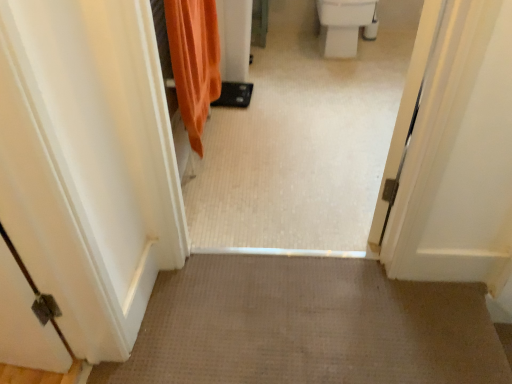
Locate an element on the screen. The image size is (512, 384). white glossy tile floor at center is located at coordinates (303, 144).

Is white glossy toilet bowl at upper right bigger or smaller than orange fabric shower curtain at upper left?

In the image, white glossy toilet bowl at upper right appears to be larger than orange fabric shower curtain at upper left.

Where is `toilet bowl lying above the orange fabric shower curtain at upper left (from the image's perspective)`? The height and width of the screenshot is (384, 512). toilet bowl lying above the orange fabric shower curtain at upper left (from the image's perspective) is located at coordinates (344, 25).

Is white glossy toilet bowl at upper right behind orange fabric shower curtain at upper left?

Yes, it is.

Is white glossy toilet bowl at upper right looking in the opposite direction of orange fabric shower curtain at upper left?

No, white glossy toilet bowl at upper right is not facing away from orange fabric shower curtain at upper left.

Is point (203, 38) positioned behind point (311, 213)?

Yes, point (203, 38) is farther from viewer.

Considering the relative positions of orange fabric shower curtain at upper left and white glossy tile floor at center in the image provided, is orange fabric shower curtain at upper left to the left or to the right of white glossy tile floor at center?

Based on their positions, orange fabric shower curtain at upper left is located to the left of white glossy tile floor at center.

Can you confirm if orange fabric shower curtain at upper left is bigger than white glossy tile floor at center?

No.

The width and height of the screenshot is (512, 384). I want to click on toilet bowl that appears below the white glossy tile floor at center (from a real-world perspective), so click(x=344, y=25).

Could you tell me if white glossy tile floor at center is turned towards white glossy toilet bowl at upper right?

Yes, white glossy tile floor at center is aimed at white glossy toilet bowl at upper right.

Is white glossy toilet bowl at upper right inside white glossy tile floor at center?

No, white glossy toilet bowl at upper right is located outside of white glossy tile floor at center.

Which object is closer to the camera, white glossy tile floor at center or white glossy toilet bowl at upper right?

white glossy tile floor at center is more forward.

Considering the positions of objects white glossy toilet bowl at upper right and white glossy tile floor at center in the image provided, who is more to the right, white glossy toilet bowl at upper right or white glossy tile floor at center?

From the viewer's perspective, white glossy toilet bowl at upper right appears more on the right side.

Where is `toilet bowl above the white glossy tile floor at center (from the image's perspective)`? toilet bowl above the white glossy tile floor at center (from the image's perspective) is located at coordinates (344, 25).

From the image's perspective, would you say white glossy toilet bowl at upper right is shown under white glossy tile floor at center?

No, from the image's perspective, white glossy toilet bowl at upper right is not beneath white glossy tile floor at center.

Considering the relative sizes of white glossy toilet bowl at upper right and white glossy tile floor at center in the image provided, is white glossy toilet bowl at upper right taller than white glossy tile floor at center?

No.

Does white glossy tile floor at center have a greater height compared to orange fabric shower curtain at upper left?

Correct, white glossy tile floor at center is much taller as orange fabric shower curtain at upper left.

Can you confirm if white glossy tile floor at center is wider than orange fabric shower curtain at upper left?

Yes, white glossy tile floor at center is wider than orange fabric shower curtain at upper left.

Is orange fabric shower curtain at upper left surrounded by white glossy tile floor at center?

No, white glossy tile floor at center does not contain orange fabric shower curtain at upper left.

Could you tell me if orange fabric shower curtain at upper left is turned towards white glossy toilet bowl at upper right?

No, orange fabric shower curtain at upper left is not facing towards white glossy toilet bowl at upper right.

Considering the positions of point (205, 66) and point (359, 13), is point (205, 66) closer or farther from the camera than point (359, 13)?

Point (205, 66) is positioned closer to the camera compared to point (359, 13).

Locate an element on the screen. The height and width of the screenshot is (384, 512). toilet bowl on the right of orange fabric shower curtain at upper left is located at coordinates (344, 25).

In the scene shown: Does orange fabric shower curtain at upper left appear on the right side of white glossy toilet bowl at upper right?

In fact, orange fabric shower curtain at upper left is to the left of white glossy toilet bowl at upper right.

Locate an element on the screen. The image size is (512, 384). toilet bowl lying behind the orange fabric shower curtain at upper left is located at coordinates (344, 25).

There is a orange fabric shower curtain at upper left. Identify the location of passage above it (from a real-world perspective). (303, 144).

When comparing their distances from white glossy toilet bowl at upper right, does white glossy tile floor at center or orange fabric shower curtain at upper left seem closer?

white glossy tile floor at center lies closer to white glossy toilet bowl at upper right than the other object.

Considering their positions, is orange fabric shower curtain at upper left positioned further to white glossy toilet bowl at upper right than white glossy tile floor at center?

orange fabric shower curtain at upper left is further to white glossy toilet bowl at upper right.

When comparing their distances from orange fabric shower curtain at upper left, does white glossy toilet bowl at upper right or white glossy tile floor at center seem further?

white glossy toilet bowl at upper right lies further to orange fabric shower curtain at upper left than the other object.

Based on their spatial positions, is white glossy tile floor at center or white glossy toilet bowl at upper right further from orange fabric shower curtain at upper left?

white glossy toilet bowl at upper right is positioned further to the anchor orange fabric shower curtain at upper left.

Consider the image. When comparing their distances from white glossy tile floor at center, does orange fabric shower curtain at upper left or white glossy toilet bowl at upper right seem closer?

orange fabric shower curtain at upper left is positioned closer to the anchor white glossy tile floor at center.

From the image, which object appears to be farther from white glossy tile floor at center, white glossy toilet bowl at upper right or orange fabric shower curtain at upper left?

Based on the image, white glossy toilet bowl at upper right appears to be further to white glossy tile floor at center.

The width and height of the screenshot is (512, 384). I want to click on shower curtain between white glossy tile floor at center and white glossy toilet bowl at upper right in the front-back direction, so click(194, 61).